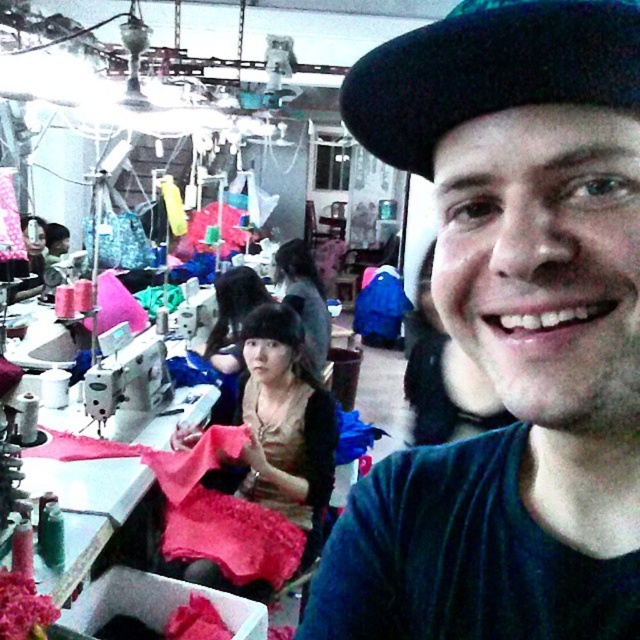
Question: Among these points, which one is nearest to the camera?

Choices:
 (A) (156, 404)
 (B) (371, 51)

Answer: (A)

Question: Does black felt hat at upper center have a smaller size compared to matte pink fabric at center?

Choices:
 (A) no
 (B) yes

Answer: (B)

Question: Which object is positioned closest to the metallic silver sewing machine at left?

Choices:
 (A) black matte hat at upper center
 (B) matte pink fabric at center
 (C) black felt hat at upper center

Answer: (B)

Question: Does black matte hat at upper center have a lesser width compared to black felt hat at upper center?

Choices:
 (A) yes
 (B) no

Answer: (B)

Question: Which of the following is the closest to the observer?

Choices:
 (A) black felt hat at upper center
 (B) metallic silver sewing machine at left
 (C) matte pink fabric at center

Answer: (A)

Question: Is black matte hat at upper center to the left of metallic silver sewing machine at left from the viewer's perspective?

Choices:
 (A) yes
 (B) no

Answer: (B)